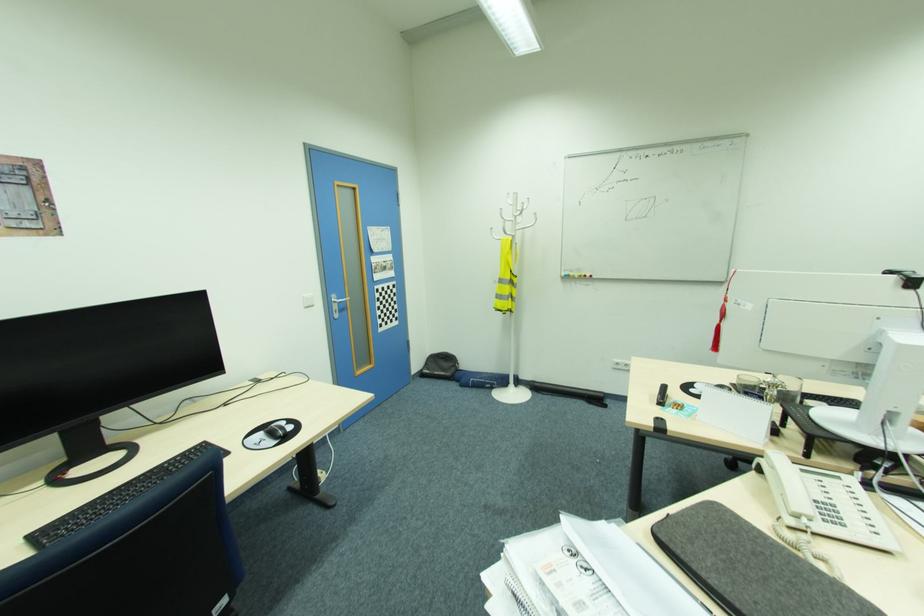
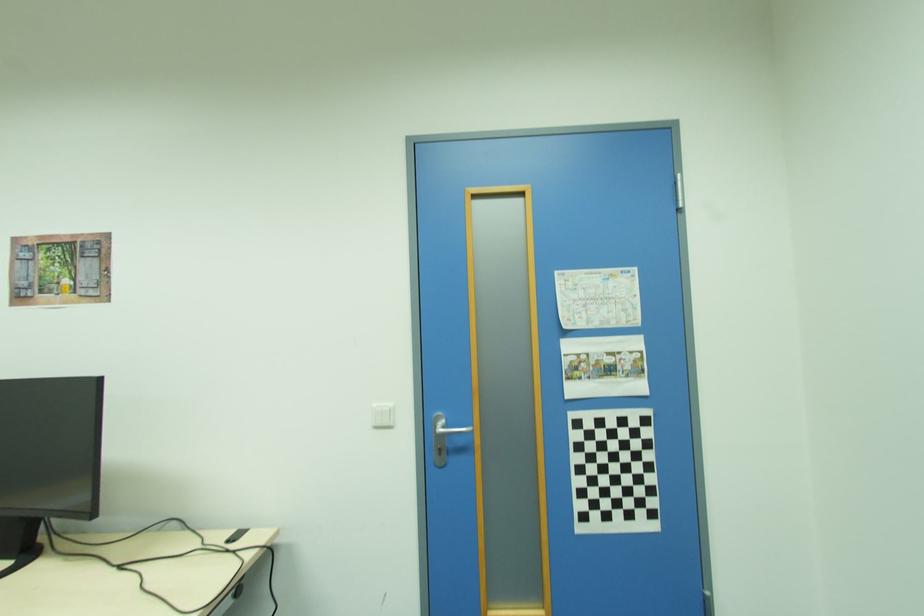
In the second image, find the point that corresponds to [399,318] in the first image.

(655, 515)